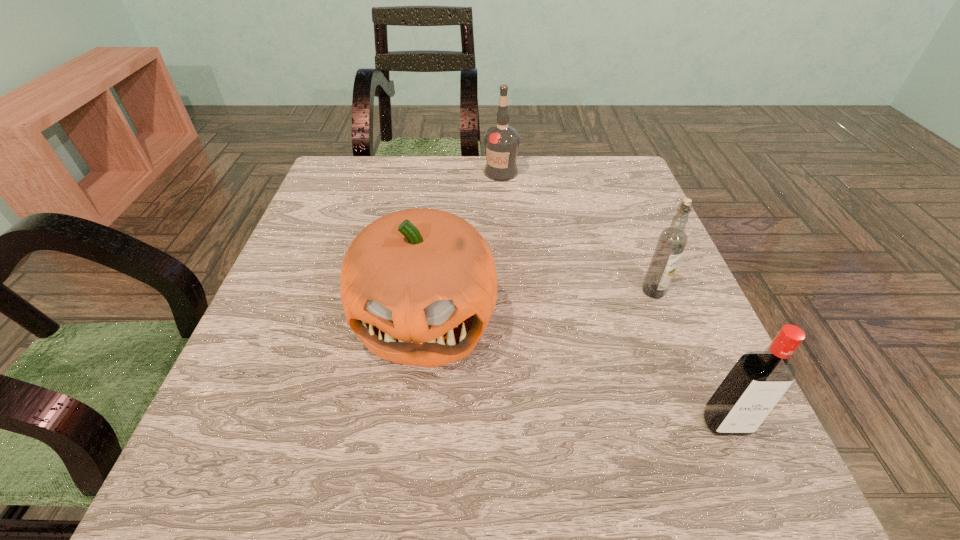
You are a GUI agent. You are given a task and a screenshot of the screen. Output one action in this format:
    pyautogui.click(x=<x>, y=<y>)
    Task: Click on the vacant area between the nearest vodka and the farthest object
    Image resolution: width=960 pixels, height=540 pixels.
    Given the screenshot: What is the action you would take?
    pyautogui.click(x=613, y=298)

Identify the location of vacant area that lies between the second nearest vodka and the nearest object. This screenshot has width=960, height=540. (689, 357).

Where is `unoccupied area between the nearest object and the farthest vodka`? This screenshot has width=960, height=540. unoccupied area between the nearest object and the farthest vodka is located at coordinates (613, 298).

Identify the location of free space between the nearest object and the pumpkin. point(575,370).

Where is `object that can be found as the closest to the second farthest vodka`? The width and height of the screenshot is (960, 540). object that can be found as the closest to the second farthest vodka is located at coordinates (759, 379).

Find the location of a particular element. object that is the closest one to the nearest vodka is located at coordinates (672, 240).

Find the location of a particular element. The width and height of the screenshot is (960, 540). vodka that is the second closest one to the leftmost vodka is located at coordinates (759, 379).

Identify which vodka is the second closest to the second nearest vodka. Please provide its 2D coordinates. Your answer should be formatted as a tuple, i.e. [(x, y)], where the tuple contains the x and y coordinates of a point satisfying the conditions above.

[(501, 142)]